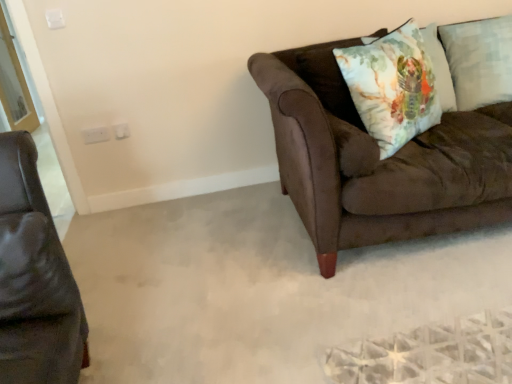
Question: From a real-world perspective, is watercolor fabric pillow at upper right above or below brown leather armchair at left?

Choices:
 (A) below
 (B) above

Answer: (B)

Question: Is watercolor fabric pillow at upper right to the left or to the right of brown leather armchair at left in the image?

Choices:
 (A) right
 (B) left

Answer: (A)

Question: Which object is the farthest from the light blue textured pillow at upper right, the first pillow positioned from the right?

Choices:
 (A) floral cotton cushion at upper right, which is the first pillow in left-to-right order
 (B) watercolor fabric pillow at upper right
 (C) suede brown couch at right, the 2th studio couch positioned from the left
 (D) matte black leather couch at left, marked as the second studio couch in a right-to-left arrangement
 (E) brown leather armchair at left

Answer: (D)

Question: Based on their relative distances, which object is nearer to the light blue textured pillow at upper right, the first pillow positioned from the right?

Choices:
 (A) transparent glass screen door at upper left
 (B) matte black leather couch at left, the first studio couch in the left-to-right sequence
 (C) watercolor fabric pillow at upper right
 (D) suede brown couch at right, which is the 2th studio couch in front-to-back order
 (E) brown leather armchair at left

Answer: (D)